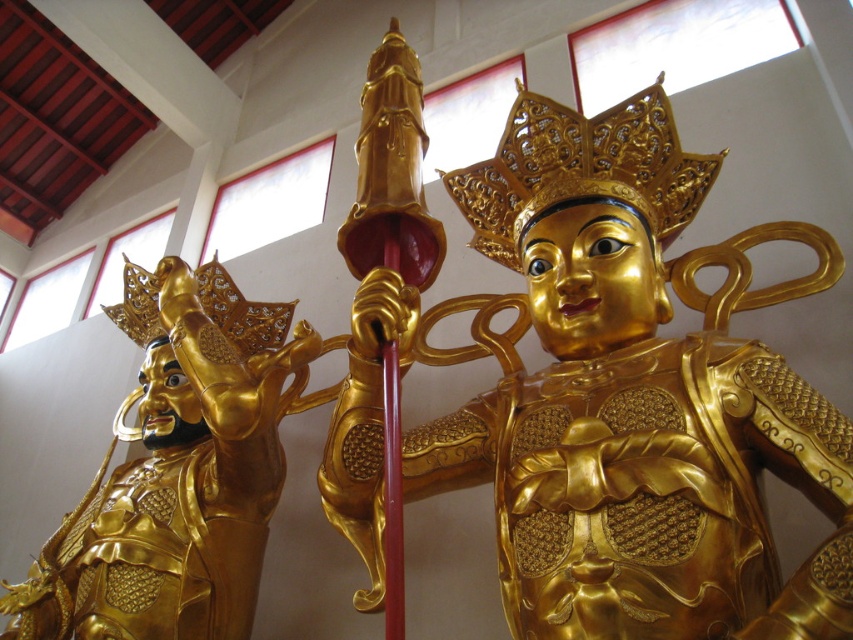
Which is more to the left, gold polished statue at center or gold polished armor at left?

gold polished armor at left is more to the left.

Can you confirm if gold polished statue at center is bigger than gold polished armor at left?

No.

The width and height of the screenshot is (853, 640). In order to click on gold polished statue at center in this screenshot , I will do `click(611, 400)`.